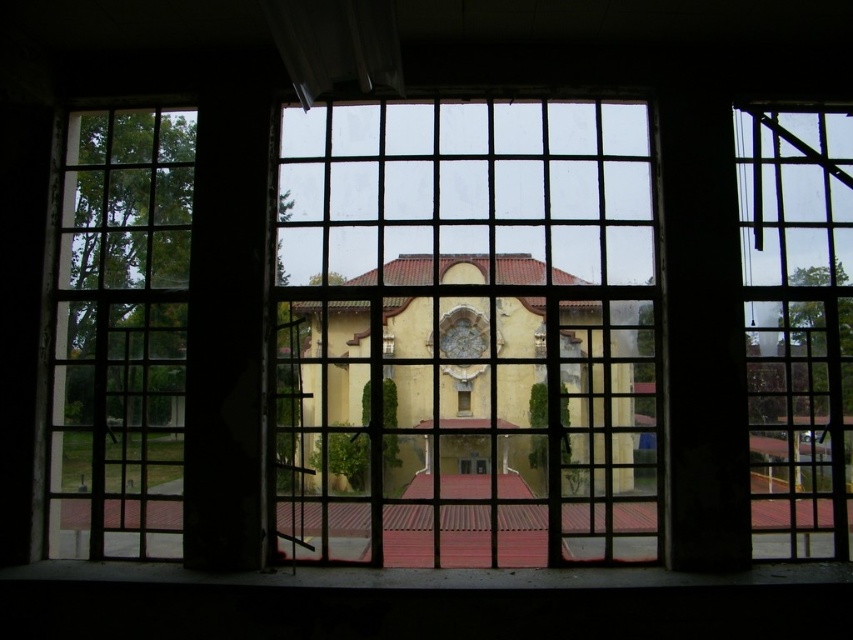
Question: Among these objects, which one is farthest from the camera?

Choices:
 (A) clear glass window at right
 (B) clear glass window at left
 (C) clear glass window at center
 (D) yellow matte building at center

Answer: (D)

Question: Which point appears farthest from the camera in this image?

Choices:
 (A) (119, 280)
 (B) (515, 413)

Answer: (A)

Question: Does clear glass window at center come behind clear glass window at left?

Choices:
 (A) yes
 (B) no

Answer: (B)

Question: Can you confirm if clear glass window at left is wider than clear glass window at right?

Choices:
 (A) no
 (B) yes

Answer: (B)

Question: Does clear glass window at left appear on the right side of yellow matte building at center?

Choices:
 (A) no
 (B) yes

Answer: (A)

Question: Which point appears closest to the camera in this image?

Choices:
 (A) (843, 420)
 (B) (440, 317)
 (C) (386, 531)
 (D) (108, 470)

Answer: (A)